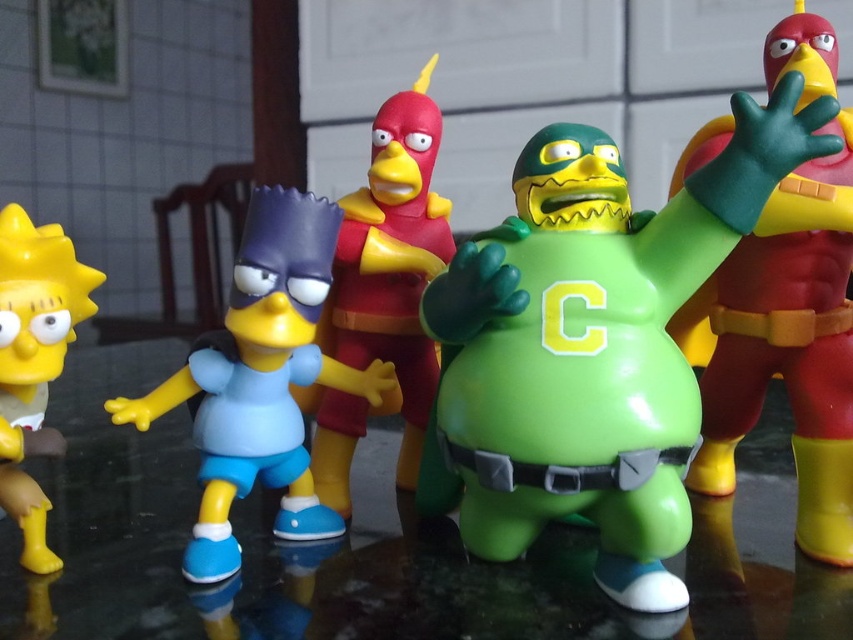
In the scene with the green matte figure at center and the shiny red and yellow figure at center right, which one is positioned to the left?

The green matte figure at center is positioned to the left of the shiny red and yellow figure at center right.

You are standing at point (786, 344) in the image. What object is located at this point?

The shiny red and yellow figure at center right is located at point (786, 344).